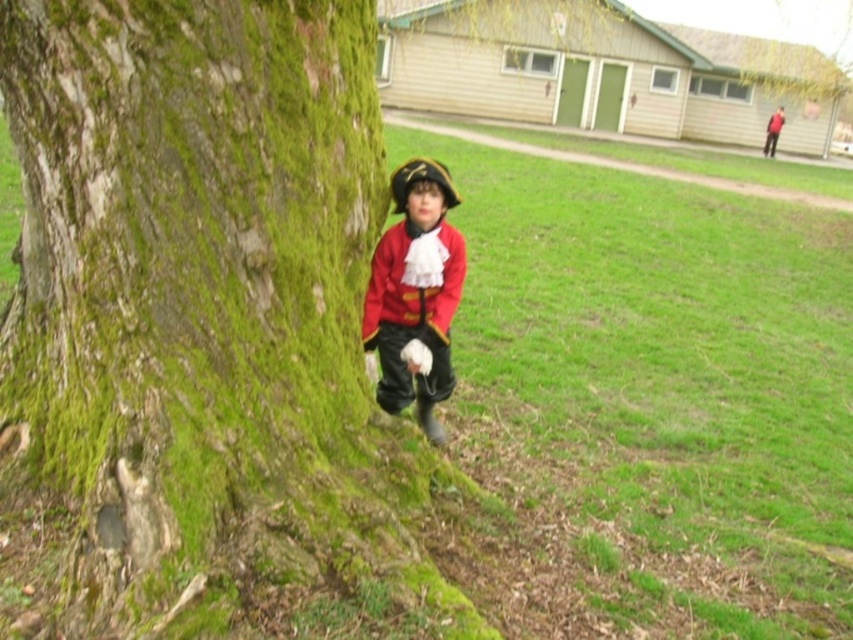
Can you confirm if matte red coat at center is smaller than matte red jacket at center?

No.

Is matte red coat at center thinner than matte red jacket at center?

Correct, matte red coat at center's width is less than matte red jacket at center's.

Does point (393, 278) lie behind point (463, 257)?

No.

The image size is (853, 640). I want to click on matte red coat at center, so click(415, 294).

Can you confirm if green mossy bark at left is shorter than matte red coat at center?

No, green mossy bark at left is not shorter than matte red coat at center.

Measure the distance between green mossy bark at left and camera.

A distance of 6.67 feet exists between green mossy bark at left and camera.

Find the location of a particular element. green mossy bark at left is located at coordinates (206, 310).

Is point (18, 376) more distant than point (453, 304)?

No, it is in front of (453, 304).

Is green mossy bark at left in front of matte red jacket at center?

Yes, green mossy bark at left is closer to the viewer.

Between point (38, 54) and point (427, 321), which one is positioned behind?

Positioned behind is point (427, 321).

Where is `green mossy bark at left`? green mossy bark at left is located at coordinates (206, 310).